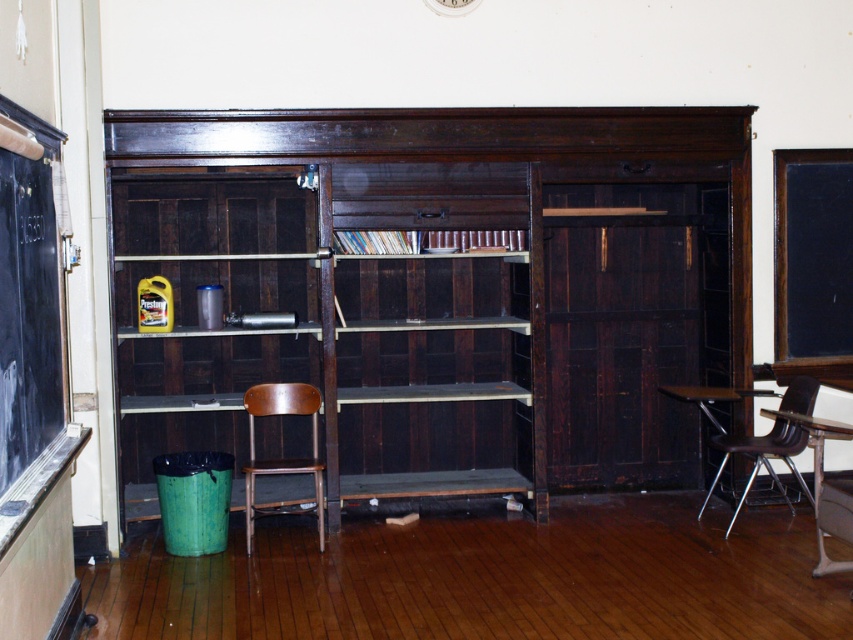
Question: Which point is closer to the camera?

Choices:
 (A) (347, 480)
 (B) (47, 308)

Answer: (B)

Question: Can you confirm if metallic brown chair at right is bigger than metallic brown table at right?

Choices:
 (A) no
 (B) yes

Answer: (A)

Question: Is wooden desk at lower right positioned in front of metallic brown table at right?

Choices:
 (A) yes
 (B) no

Answer: (A)

Question: Can you confirm if brown wooden chair at center is smaller than metallic brown chair at right?

Choices:
 (A) no
 (B) yes

Answer: (A)

Question: Which point appears closest to the camera in this image?

Choices:
 (A) (833, 564)
 (B) (10, 273)
 (C) (310, 467)
 (D) (374, 257)

Answer: (B)

Question: Which object is positioned farthest from the metallic silver shelf at center?

Choices:
 (A) black chalkboard at left
 (B) hardcover books at center
 (C) brown wooden chair at center
 (D) metallic brown chair at right

Answer: (A)